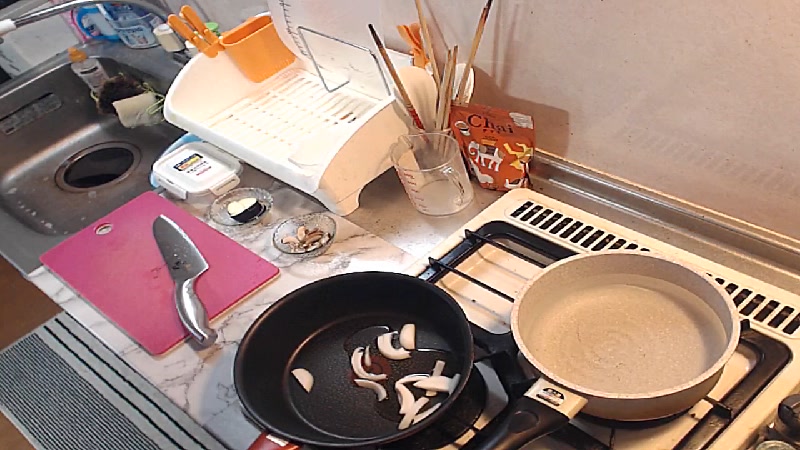
This screenshot has width=800, height=450. I want to click on sink, so click(x=46, y=113).